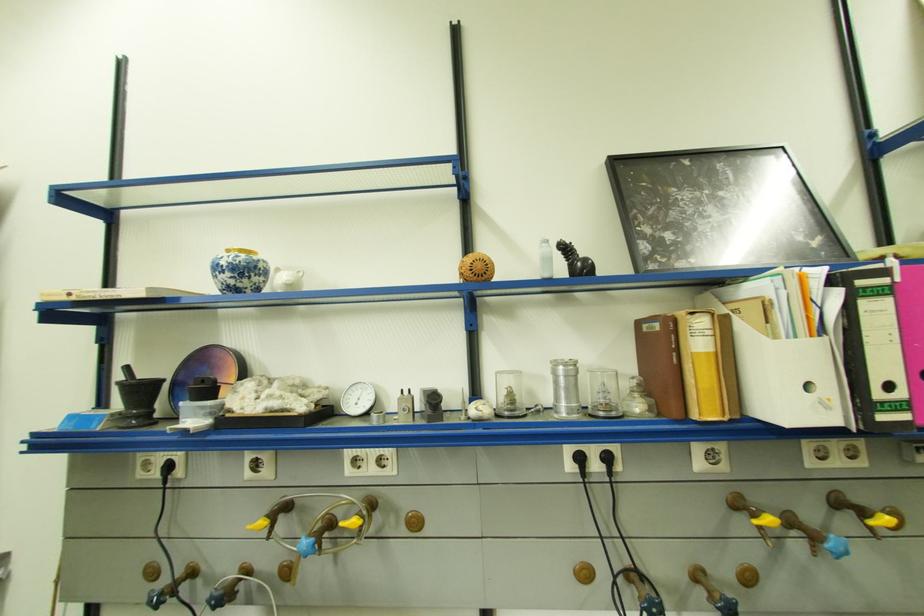
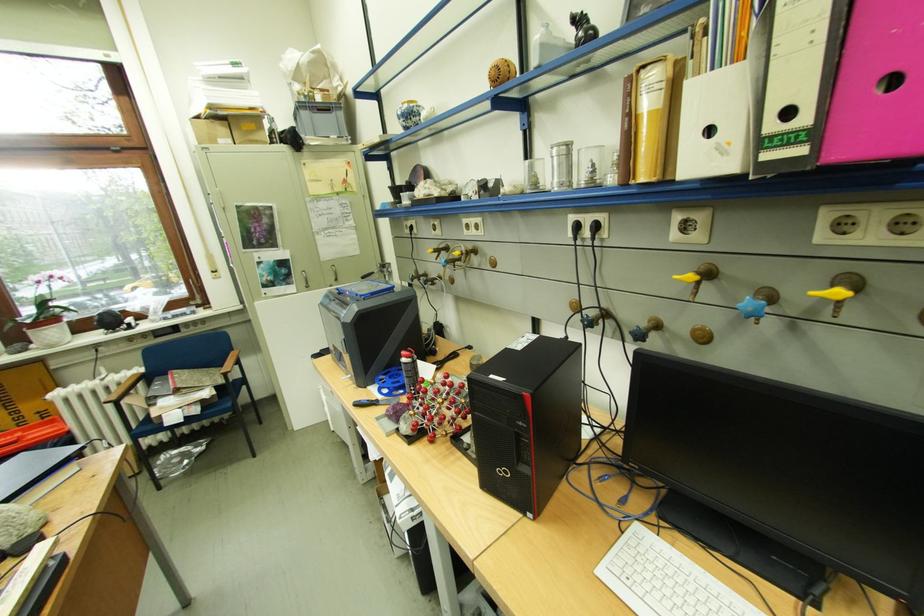
The point at (x=256, y=281) is marked in the first image. Where is the corresponding point in the second image?

(419, 122)